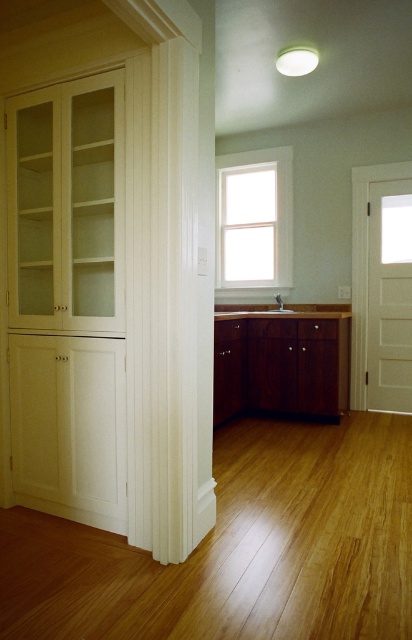
Question: Which point is farther to the camera?

Choices:
 (A) (290, 312)
 (B) (327, 404)

Answer: (A)

Question: Among these objects, which one is nearest to the camera?

Choices:
 (A) white wood window at center
 (B) white glossy sink at center

Answer: (B)

Question: Considering the real-world distances, which object is farthest from the mahogany wood cabinet at center?

Choices:
 (A) white glossy sink at center
 (B) white wood window at center

Answer: (B)

Question: Does white wood window at center have a larger size compared to white glossy sink at center?

Choices:
 (A) no
 (B) yes

Answer: (B)

Question: Can you confirm if mahogany wood cabinet at center is positioned to the left of white wood window at center?

Choices:
 (A) yes
 (B) no

Answer: (B)

Question: In this image, where is mahogany wood cabinet at center located relative to white wood window at center?

Choices:
 (A) left
 (B) right

Answer: (B)